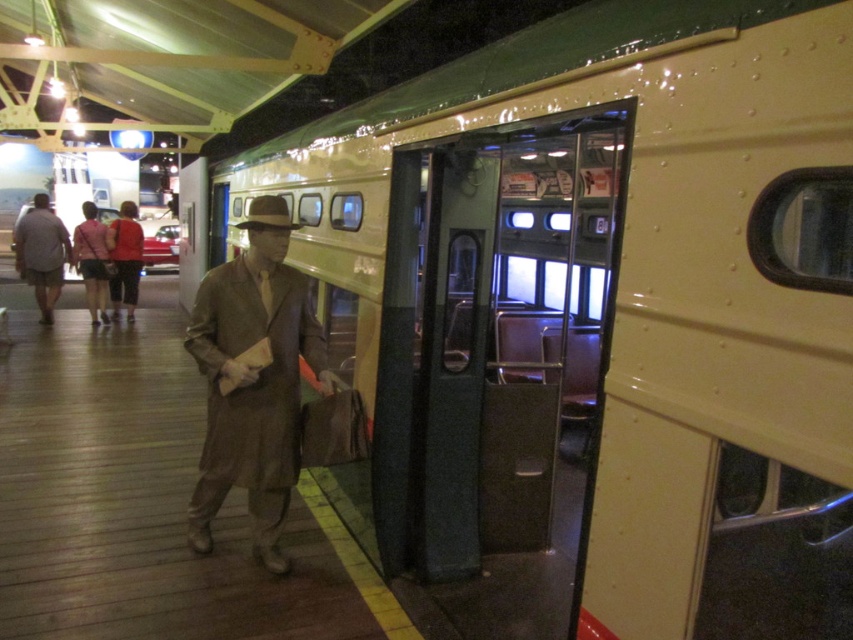
Can you confirm if light beige fabric pants at left is positioned to the left of matte pink jacket at center?

Correct, you'll find light beige fabric pants at left to the left of matte pink jacket at center.

Describe the element at coordinates (41, 253) in the screenshot. I see `light beige fabric pants at left` at that location.

The height and width of the screenshot is (640, 853). Find the location of `light beige fabric pants at left`. light beige fabric pants at left is located at coordinates (41, 253).

Can you confirm if brown wool coat at center is positioned above matte pink jacket at center?

Actually, brown wool coat at center is below matte pink jacket at center.

Who is shorter, brown wool coat at center or matte pink jacket at center?

With less height is matte pink jacket at center.

Does point (234, 260) lie in front of point (107, 323)?

Yes.

The width and height of the screenshot is (853, 640). I want to click on brown wool coat at center, so click(x=253, y=380).

Is light beige fabric pants at left further to camera compared to red fabric jacket at center?

No, light beige fabric pants at left is closer to the viewer.

Between light beige fabric pants at left and red fabric jacket at center, which one appears on the left side from the viewer's perspective?

light beige fabric pants at left is more to the left.

Which is in front, point (16, 253) or point (134, 216)?

Point (16, 253)

In order to click on light beige fabric pants at left in this screenshot , I will do `click(41, 253)`.